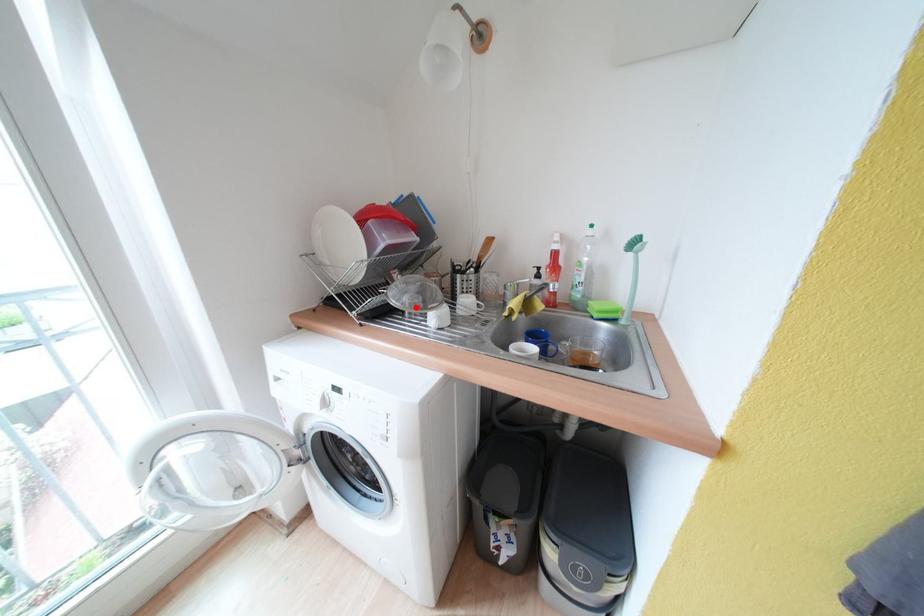
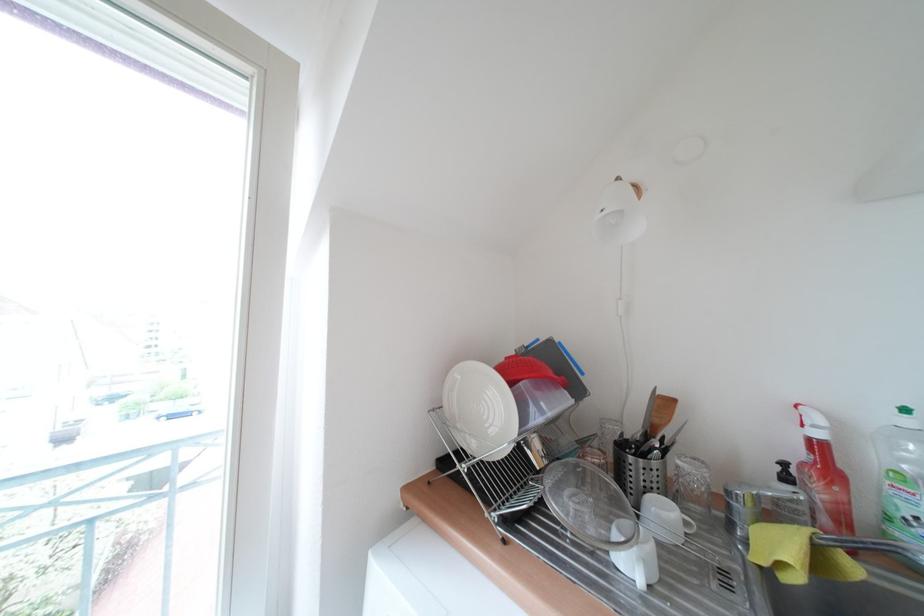
In the second image, find the point that corresponds to the highlighted location in the first image.

(582, 515)